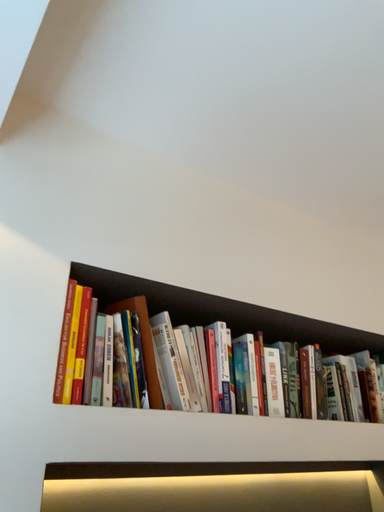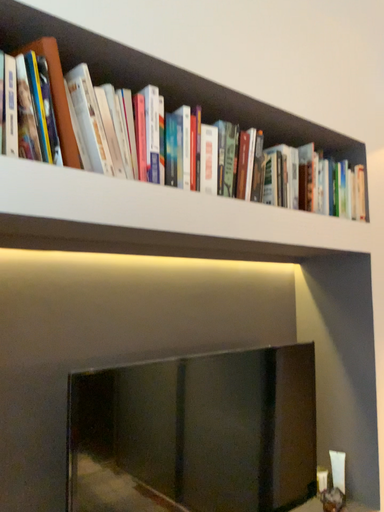
Question: Which way did the camera rotate in the video?

Choices:
 (A) rotated upward
 (B) rotated downward

Answer: (B)